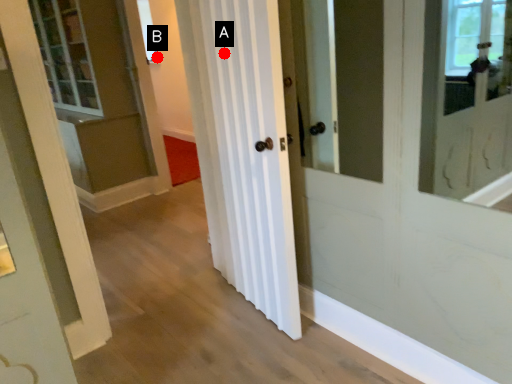
Question: Two points are circled on the image, labeled by A and B beside each circle. Which point is closer to the camera taking this photo?

Choices:
 (A) A is closer
 (B) B is closer

Answer: (A)